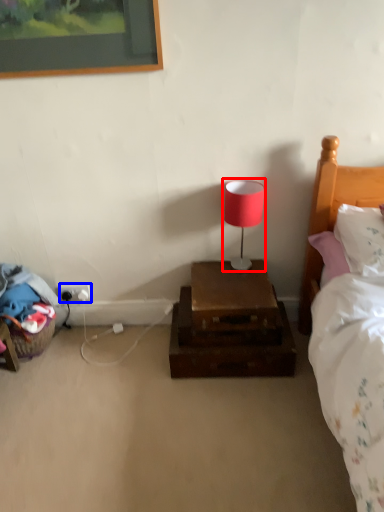
Question: Among these objects, which one is nearest to the camera, table lamp (highlighted by a red box) or electric outlet (highlighted by a blue box)?

Choices:
 (A) table lamp
 (B) electric outlet

Answer: (A)